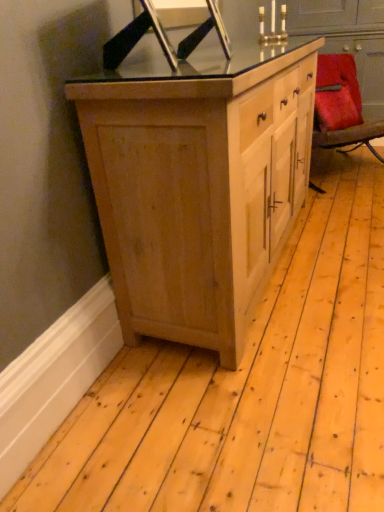
The width and height of the screenshot is (384, 512). Describe the element at coordinates (341, 106) in the screenshot. I see `velvet red chair at right` at that location.

At what (x,y) coordinates should I click in order to perform the action: click on natural wood cabinet at center. Please return your answer as a coordinate pair (x, y). Looking at the image, I should click on (198, 184).

Considering the sizes of objects metallic gold candle holder at upper center and velvet red chair at right in the image provided, who is thinner, metallic gold candle holder at upper center or velvet red chair at right?

With smaller width is metallic gold candle holder at upper center.

Would you say metallic gold candle holder at upper center is a long distance from velvet red chair at right?

They are positioned close to each other.

Is metallic gold candle holder at upper center positioned behind velvet red chair at right?

No.

Which point is more forward, (274,9) or (328,91)?

The point (328,91) is closer.

Which of these two, natural wood cabinet at center or metallic gold candle holder at upper center, is thinner?

Thinner between the two is metallic gold candle holder at upper center.

Is natural wood cabinet at center with metallic gold candle holder at upper center?

No, natural wood cabinet at center is not beside metallic gold candle holder at upper center.

Is natural wood cabinet at center oriented towards metallic gold candle holder at upper center?

No, natural wood cabinet at center is not turned towards metallic gold candle holder at upper center.

Based on the photo, who is more distant, natural wood cabinet at center or metallic gold candle holder at upper center?

Positioned behind is metallic gold candle holder at upper center.

Between velvet red chair at right and natural wood cabinet at center, which one is positioned behind?

velvet red chair at right is further from the camera.

From a real-world perspective, who is located lower, velvet red chair at right or natural wood cabinet at center?

velvet red chair at right.

Is velvet red chair at right taller or shorter than natural wood cabinet at center?

Clearly, velvet red chair at right is shorter compared to natural wood cabinet at center.

From the image's perspective, is velvet red chair at right positioned above or below natural wood cabinet at center?

velvet red chair at right is above natural wood cabinet at center.

From the image's perspective, is metallic gold candle holder at upper center positioned above or below natural wood cabinet at center?

Based on their image positions, metallic gold candle holder at upper center is located above natural wood cabinet at center.

Considering the sizes of objects metallic gold candle holder at upper center and natural wood cabinet at center in the image provided, who is wider, metallic gold candle holder at upper center or natural wood cabinet at center?

Wider between the two is natural wood cabinet at center.

Is metallic gold candle holder at upper center positioned far away from natural wood cabinet at center?

Yes, metallic gold candle holder at upper center and natural wood cabinet at center are located far from each other.

Looking at this image, considering the relative sizes of natural wood cabinet at center and velvet red chair at right in the image provided, is natural wood cabinet at center taller than velvet red chair at right?

Yes.

Is point (296, 161) closer or farther from the camera than point (331, 95)?

Point (296, 161) is positioned closer to the camera compared to point (331, 95).

In terms of width, does natural wood cabinet at center look wider or thinner when compared to velvet red chair at right?

Clearly, natural wood cabinet at center has more width compared to velvet red chair at right.

Between velvet red chair at right and metallic gold candle holder at upper center, which one is positioned in front?

Answer: metallic gold candle holder at upper center is more forward.

Between point (332, 61) and point (265, 41), which one is positioned in front?

The point (265, 41) is more forward.

I want to click on candle holder above the velvet red chair at right (from a real-world perspective), so click(272, 25).

You are a GUI agent. You are given a task and a screenshot of the screen. Output one action in this format:
    pyautogui.click(x=<x>, y=<y>)
    Task: Click on the candle holder positioned vertically above the velvet red chair at right (from a real-world perspective)
    Image resolution: width=384 pixels, height=512 pixels.
    Given the screenshot: What is the action you would take?
    pyautogui.click(x=272, y=25)

Find the location of a particular element. The image size is (384, 512). candle holder on the right of the natural wood cabinet at center is located at coordinates point(272,25).

Estimate the real-world distances between objects in this image. Which object is closer to metallic gold candle holder at upper center, natural wood cabinet at center or velvet red chair at right?

Based on the image, velvet red chair at right appears to be nearer to metallic gold candle holder at upper center.

Considering their positions, is velvet red chair at right positioned closer to metallic gold candle holder at upper center than natural wood cabinet at center?

Based on the image, velvet red chair at right appears to be nearer to metallic gold candle holder at upper center.

From the image, which object appears to be farther from natural wood cabinet at center, velvet red chair at right or metallic gold candle holder at upper center?

metallic gold candle holder at upper center lies further to natural wood cabinet at center than the other object.

From the image, which object appears to be nearer to natural wood cabinet at center, metallic gold candle holder at upper center or velvet red chair at right?

velvet red chair at right lies closer to natural wood cabinet at center than the other object.

When comparing their distances from velvet red chair at right, does natural wood cabinet at center or metallic gold candle holder at upper center seem closer?

metallic gold candle holder at upper center is positioned closer to the anchor velvet red chair at right.

When comparing their distances from velvet red chair at right, does metallic gold candle holder at upper center or natural wood cabinet at center seem further?

natural wood cabinet at center.

You are a GUI agent. You are given a task and a screenshot of the screen. Output one action in this format:
    pyautogui.click(x=<x>, y=<y>)
    Task: Click on the candle holder between natural wood cabinet at center and velvet red chair at right in the front-back direction
    The width and height of the screenshot is (384, 512).
    Given the screenshot: What is the action you would take?
    pyautogui.click(x=272, y=25)